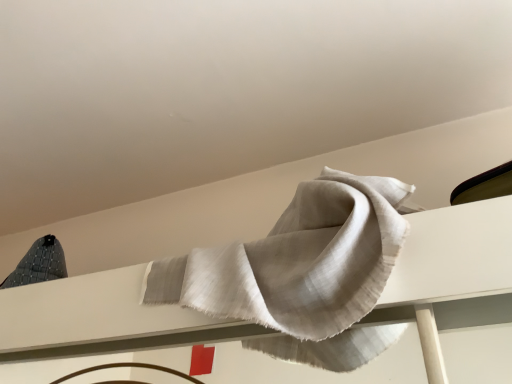
The width and height of the screenshot is (512, 384). What are the coordinates of `light gray textured towel at upper center` in the screenshot? It's located at (303, 273).

What do you see at coordinates (303, 273) in the screenshot? Image resolution: width=512 pixels, height=384 pixels. I see `light gray textured towel at upper center` at bounding box center [303, 273].

This screenshot has width=512, height=384. In order to click on light gray textured towel at upper center in this screenshot , I will do `click(303, 273)`.